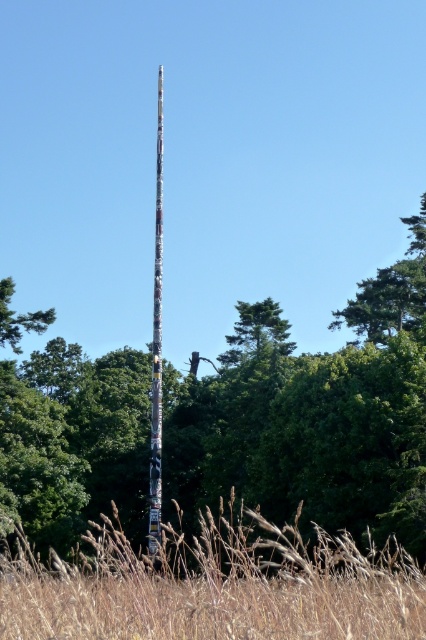
Is point (152, 401) closer to camera compared to point (281, 337)?

Yes, it is in front of point (281, 337).

Who is positioned more to the right, smooth gray pole at center or green textured tree at center?

From the viewer's perspective, green textured tree at center appears more on the right side.

Identify the location of smooth gray pole at center. (157, 349).

This screenshot has height=640, width=426. I want to click on smooth gray pole at center, so click(157, 349).

Which is more to the left, brown dry grass at center or green textured tree at center?

brown dry grass at center

The height and width of the screenshot is (640, 426). In order to click on brown dry grass at center in this screenshot , I will do `click(215, 586)`.

Find the location of a particular element. brown dry grass at center is located at coordinates (215, 586).

Which is more to the right, carved wooden totem pole at center or smooth gray pole at center?

Positioned to the right is carved wooden totem pole at center.

Is carved wooden totem pole at center positioned at the back of smooth gray pole at center?

That is False.

Between point (97, 436) and point (155, 381), which one is positioned behind?

The point (97, 436) is more distant.

Locate an element on the screen. This screenshot has height=640, width=426. carved wooden totem pole at center is located at coordinates (316, 420).